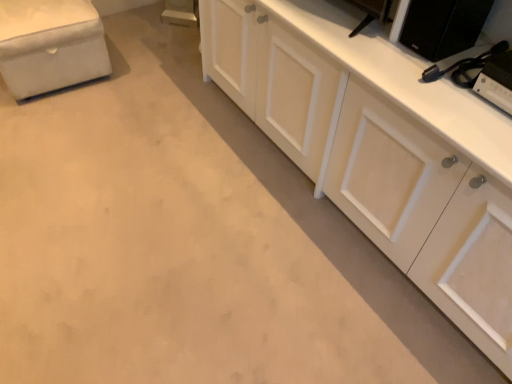
In order to face white fabric ottoman at upper left, should I rotate leftwards or rightwards?

To align with it, rotate left about 26.198°.

The height and width of the screenshot is (384, 512). I want to click on white wood cabinet at right, so click(x=329, y=121).

Describe the element at coordinates (329, 121) in the screenshot. The image size is (512, 384). I see `white wood cabinet at right` at that location.

Find the location of a particular element. Image resolution: width=512 pixels, height=384 pixels. black matte speaker at upper right, acting as the first appliance starting from the top is located at coordinates (443, 26).

Identify the location of white fabric ottoman at upper left. This screenshot has width=512, height=384. (50, 45).

Is black matte speaker at upper right, the second appliance when ordered from bottom to top, situated inside black plastic game console at upper right, arranged as the 1th appliance when ordered from the bottom, or outside?

black matte speaker at upper right, the second appliance when ordered from bottom to top, exists outside the volume of black plastic game console at upper right, arranged as the 1th appliance when ordered from the bottom.

From the image's perspective, is black matte speaker at upper right, acting as the first appliance starting from the top, below black plastic game console at upper right, arranged as the 1th appliance when ordered from the bottom?

No, from the image's perspective, black matte speaker at upper right, acting as the first appliance starting from the top, is not below black plastic game console at upper right, arranged as the 1th appliance when ordered from the bottom.

Is black matte speaker at upper right, the second appliance when ordered from bottom to top, taller or shorter than black plastic game console at upper right, arranged as the 1th appliance when ordered from the bottom?

Considering their sizes, black matte speaker at upper right, the second appliance when ordered from bottom to top, has more height than black plastic game console at upper right, arranged as the 1th appliance when ordered from the bottom.

How distant is black matte speaker at upper right, acting as the first appliance starting from the top, from black plastic game console at upper right, arranged as the 1th appliance when ordered from the bottom?

A distance of 7.33 inches exists between black matte speaker at upper right, acting as the first appliance starting from the top, and black plastic game console at upper right, arranged as the 1th appliance when ordered from the bottom.

Is white fabric ottoman at upper left at the back of black matte speaker at upper right, acting as the first appliance starting from the top?

No, black matte speaker at upper right, acting as the first appliance starting from the top, is not facing away from white fabric ottoman at upper left.

Between black matte speaker at upper right, the second appliance when ordered from bottom to top, and white fabric ottoman at upper left, which one has smaller size?

With smaller size is black matte speaker at upper right, the second appliance when ordered from bottom to top.

Is black matte speaker at upper right, acting as the first appliance starting from the top, surrounding white fabric ottoman at upper left?

No, white fabric ottoman at upper left is not surrounded by black matte speaker at upper right, acting as the first appliance starting from the top.

Between black matte speaker at upper right, the second appliance when ordered from bottom to top, and white fabric ottoman at upper left, which one has smaller width?

Thinner between the two is black matte speaker at upper right, the second appliance when ordered from bottom to top.

From a real-world perspective, is white wood cabinet at right physically located above or below black plastic game console at upper right, the second appliance positioned from the top?

white wood cabinet at right is situated lower than black plastic game console at upper right, the second appliance positioned from the top, in the real world.

From the image's perspective, is white wood cabinet at right on black plastic game console at upper right, arranged as the 1th appliance when ordered from the bottom?

Yes.

How many degrees apart are the facing directions of white wood cabinet at right and black plastic game console at upper right, arranged as the 1th appliance when ordered from the bottom?

The facing directions of white wood cabinet at right and black plastic game console at upper right, arranged as the 1th appliance when ordered from the bottom, are 1.78 degrees apart.

Is white wood cabinet at right taller or shorter than black plastic game console at upper right, arranged as the 1th appliance when ordered from the bottom?

In the image, white wood cabinet at right appears to be taller than black plastic game console at upper right, arranged as the 1th appliance when ordered from the bottom.

From a real-world perspective, is black plastic game console at upper right, the second appliance positioned from the top, above or below white wood cabinet at right?

In terms of real-world spatial position, black plastic game console at upper right, the second appliance positioned from the top, is above white wood cabinet at right.

Is black plastic game console at upper right, arranged as the 1th appliance when ordered from the bottom, positioned in front of white wood cabinet at right?

No, black plastic game console at upper right, arranged as the 1th appliance when ordered from the bottom, is further to the viewer.

Is black plastic game console at upper right, arranged as the 1th appliance when ordered from the bottom, to the left or to the right of white wood cabinet at right in the image?

Based on their positions, black plastic game console at upper right, arranged as the 1th appliance when ordered from the bottom, is located to the right of white wood cabinet at right.

Which is in front, white fabric ottoman at upper left or white wood cabinet at right?

white wood cabinet at right is in front.

Does point (41, 41) appear closer or farther from the camera than point (376, 155)?

Point (41, 41) is positioned farther from the camera compared to point (376, 155).

From the image's perspective, who appears lower, white fabric ottoman at upper left or white wood cabinet at right?

From the image's view, white wood cabinet at right is below.

How different are the orientations of white fabric ottoman at upper left and white wood cabinet at right in degrees?

white fabric ottoman at upper left and white wood cabinet at right are facing 88.3 degrees away from each other.

Does black matte speaker at upper right, the second appliance when ordered from bottom to top, appear on the left side of white wood cabinet at right?

In fact, black matte speaker at upper right, the second appliance when ordered from bottom to top, is to the right of white wood cabinet at right.

Can you confirm if black matte speaker at upper right, acting as the first appliance starting from the top, is shorter than white wood cabinet at right?

Yes, black matte speaker at upper right, acting as the first appliance starting from the top, is shorter than white wood cabinet at right.

From a real-world perspective, is black matte speaker at upper right, acting as the first appliance starting from the top, positioned over white wood cabinet at right based on gravity?

Yes, from a real-world perspective, black matte speaker at upper right, acting as the first appliance starting from the top, is above white wood cabinet at right.

Considering the relative sizes of white wood cabinet at right and black matte speaker at upper right, the second appliance when ordered from bottom to top, in the image provided, is white wood cabinet at right smaller than black matte speaker at upper right, the second appliance when ordered from bottom to top,?

No, white wood cabinet at right is not smaller than black matte speaker at upper right, the second appliance when ordered from bottom to top.

Which is more to the right, white wood cabinet at right or black matte speaker at upper right, the second appliance when ordered from bottom to top?

black matte speaker at upper right, the second appliance when ordered from bottom to top, is more to the right.

Which object is thinner, white wood cabinet at right or black matte speaker at upper right, the second appliance when ordered from bottom to top?

black matte speaker at upper right, the second appliance when ordered from bottom to top.

Does white wood cabinet at right lie behind black matte speaker at upper right, the second appliance when ordered from bottom to top?

No, it is not.

The image size is (512, 384). What are the coordinates of `appliance that appears above the black plastic game console at upper right, the second appliance positioned from the top (from the image's perspective)` in the screenshot? It's located at (443, 26).

Find the location of a particular element. furniture behind the black matte speaker at upper right, the second appliance when ordered from bottom to top is located at coordinates (50, 45).

Estimate the real-world distances between objects in this image. Which object is closer to white wood cabinet at right, black matte speaker at upper right, acting as the first appliance starting from the top, or white fabric ottoman at upper left?

black matte speaker at upper right, acting as the first appliance starting from the top, is closer to white wood cabinet at right.

When comparing their distances from white fabric ottoman at upper left, does white wood cabinet at right or black plastic game console at upper right, arranged as the 1th appliance when ordered from the bottom, seem further?

black plastic game console at upper right, arranged as the 1th appliance when ordered from the bottom, is positioned further to the anchor white fabric ottoman at upper left.

Considering their positions, is white fabric ottoman at upper left positioned closer to black plastic game console at upper right, arranged as the 1th appliance when ordered from the bottom, than white wood cabinet at right?

Among the two, white wood cabinet at right is located nearer to black plastic game console at upper right, arranged as the 1th appliance when ordered from the bottom.

Which object lies further to the anchor point white fabric ottoman at upper left, white wood cabinet at right or black matte speaker at upper right, the second appliance when ordered from bottom to top?

The object further to white fabric ottoman at upper left is black matte speaker at upper right, the second appliance when ordered from bottom to top.

From the image, which object appears to be farther from white wood cabinet at right, white fabric ottoman at upper left or black plastic game console at upper right, the second appliance positioned from the top?

white fabric ottoman at upper left is further to white wood cabinet at right.

Looking at the image, which one is located closer to white wood cabinet at right, white fabric ottoman at upper left or black matte speaker at upper right, acting as the first appliance starting from the top?

black matte speaker at upper right, acting as the first appliance starting from the top, is positioned closer to the anchor white wood cabinet at right.

Looking at the image, which one is located further to black matte speaker at upper right, the second appliance when ordered from bottom to top, white fabric ottoman at upper left or black plastic game console at upper right, arranged as the 1th appliance when ordered from the bottom?

white fabric ottoman at upper left is positioned further to the anchor black matte speaker at upper right, the second appliance when ordered from bottom to top.

When comparing their distances from black matte speaker at upper right, acting as the first appliance starting from the top, does white wood cabinet at right or black plastic game console at upper right, arranged as the 1th appliance when ordered from the bottom, seem closer?

Based on the image, black plastic game console at upper right, arranged as the 1th appliance when ordered from the bottom, appears to be nearer to black matte speaker at upper right, acting as the first appliance starting from the top.

This screenshot has height=384, width=512. Identify the location of cabinetry between white fabric ottoman at upper left and black plastic game console at upper right, arranged as the 1th appliance when ordered from the bottom, in the horizontal direction. (329, 121).

At what (x,y) coordinates should I click in order to perform the action: click on cabinetry between white fabric ottoman at upper left and black matte speaker at upper right, acting as the first appliance starting from the top, from left to right. Please return your answer as a coordinate pair (x, y). Looking at the image, I should click on (329, 121).

At what (x,y) coordinates should I click in order to perform the action: click on appliance between white wood cabinet at right and black matte speaker at upper right, the second appliance when ordered from bottom to top, in the front-back direction. Please return your answer as a coordinate pair (x, y). Looking at the image, I should click on (497, 81).

What are the coordinates of `appliance situated between white fabric ottoman at upper left and black plastic game console at upper right, the second appliance positioned from the top, from left to right` in the screenshot? It's located at [443, 26].